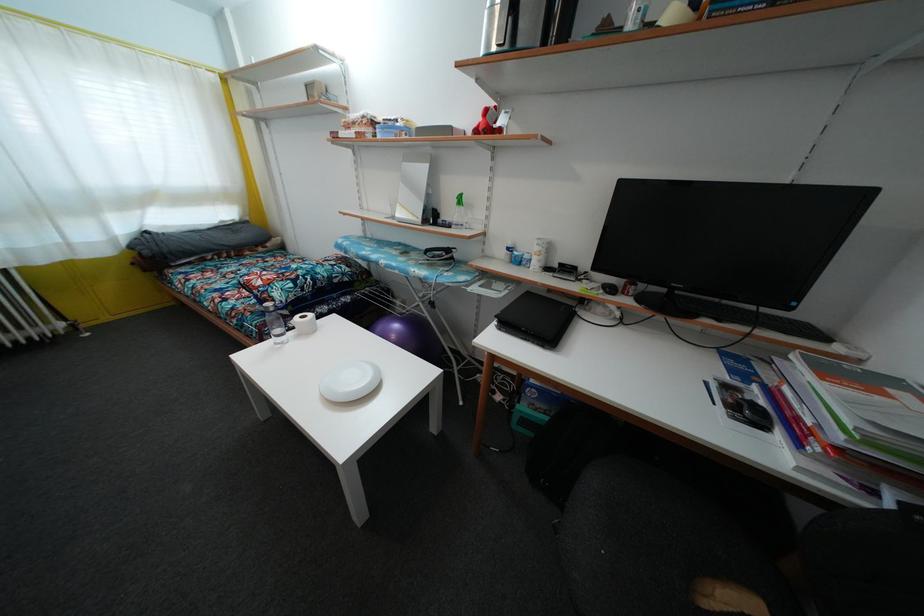
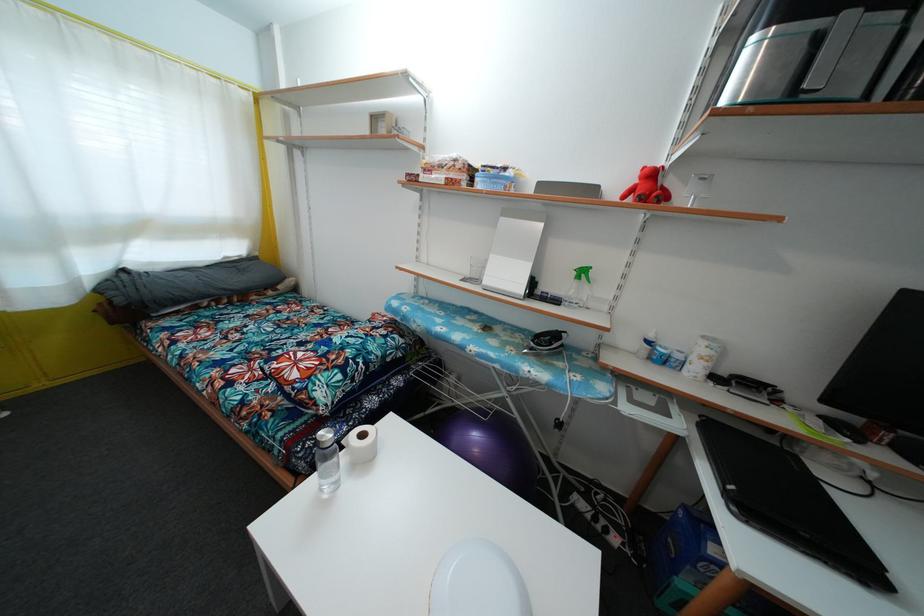
Question: The first image is from the beginning of the video and the second image is from the end. How did the camera likely rotate when shooting the video?

Choices:
 (A) Left
 (B) Right
 (C) Up
 (D) Down

Answer: (C)